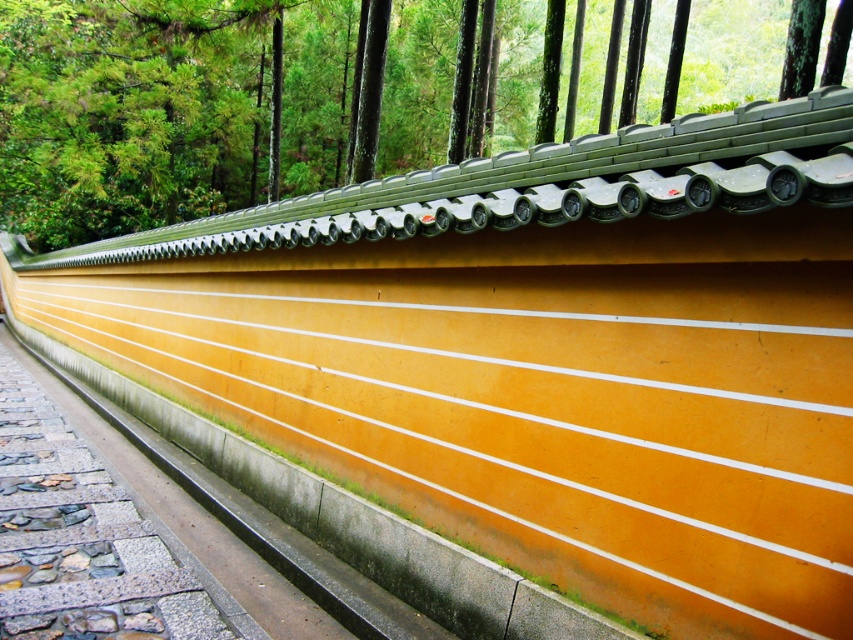
You are a visitor standing at the smooth stone path at lower left and want to reach the green matte roof tiles at upper center. Which direction should you move to get there?

The green matte roof tiles at upper center are located above the smooth stone path at lower left, so you should move upward to reach them.

You are standing 20 feet away from a traditional Japanese temple wall. You see the green matte roof tiles at upper center. Can you reach them without moving closer?

The green matte roof tiles at upper center are 22.53 feet away from the viewer. Since you are currently 20 feet away, you are still 2.53 feet away from them, so you cannot reach them without moving closer.